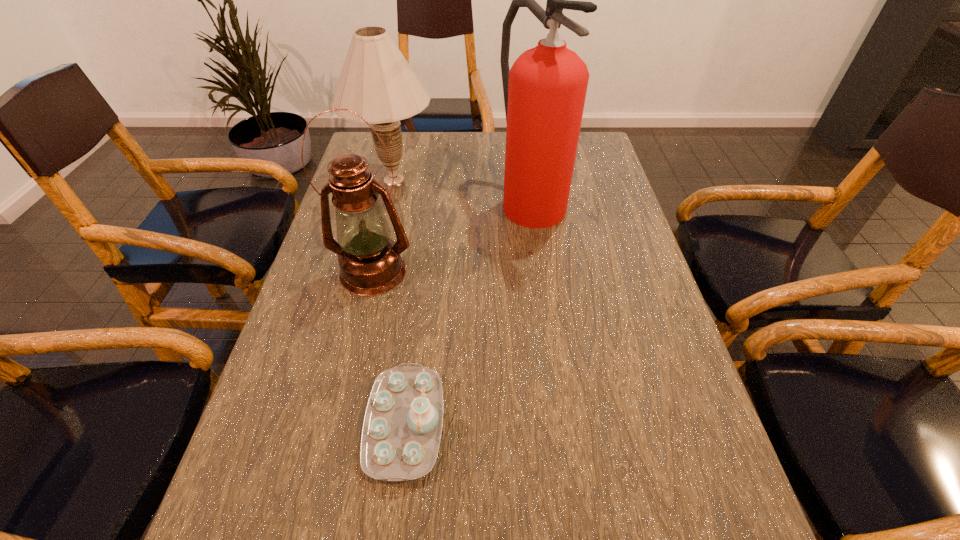
Locate an element on the screen. The width and height of the screenshot is (960, 540). the tallest object is located at coordinates (544, 91).

Image resolution: width=960 pixels, height=540 pixels. In order to click on fire extinguisher in this screenshot , I will do `click(544, 91)`.

This screenshot has height=540, width=960. I want to click on lampshade, so click(x=376, y=82).

This screenshot has width=960, height=540. Find the location of `the second nearest object`. the second nearest object is located at coordinates (370, 263).

The image size is (960, 540). Identify the location of the nearest object. (401, 433).

Find the location of a particular element. Image resolution: width=960 pixels, height=540 pixels. the shortest object is located at coordinates (401, 433).

This screenshot has width=960, height=540. Find the location of `vacant point located 0.140m on the handle side of the rightmost object`. vacant point located 0.140m on the handle side of the rightmost object is located at coordinates (541, 273).

Where is `free space located on the right of the lampshade`? The image size is (960, 540). free space located on the right of the lampshade is located at coordinates (508, 180).

Where is `free space located on the front of the third farthest object`? This screenshot has height=540, width=960. free space located on the front of the third farthest object is located at coordinates (358, 336).

Locate an element on the screen. vacant space positioned 0.160m on the back of the chinaware is located at coordinates (420, 309).